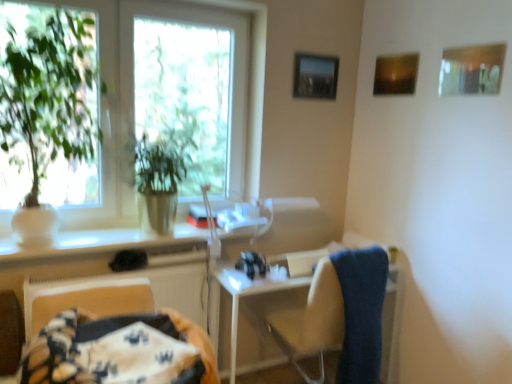
Measure the distance between blue fabric towel at right and camera.

They are 6.12 feet apart.

This screenshot has height=384, width=512. What are the coordinates of `blue fabric towel at right` in the screenshot? It's located at point(361,312).

What is the approximate height of metallic silver picture frame at upper center, the 3th picture frame positioned from the right?

25.22 centimeters.

What do you see at coordinates (315, 76) in the screenshot?
I see `metallic silver picture frame at upper center, the 3th picture frame positioned from the right` at bounding box center [315, 76].

What do you see at coordinates (471, 70) in the screenshot?
I see `wooden frame at upper right, the 1th picture frame when ordered from front to back` at bounding box center [471, 70].

Describe the element at coordinates (396, 74) in the screenshot. Image resolution: width=512 pixels, height=384 pixels. I see `matte wooden picture frame at upper right, which is counted as the 2th picture frame, starting from the back` at that location.

Locate an element on the screen. This screenshot has height=384, width=512. fluffy fabric blanket at lower left is located at coordinates (118, 348).

Can you tell me how much wooden frame at upper right, the 1th picture frame when ordered from front to back, and white glossy counter top at center differ in facing direction?

88.9 degrees.

Locate an element on the screen. Image resolution: width=512 pixels, height=384 pixels. counter top on the left of wooden frame at upper right, the third picture frame when ordered from back to front is located at coordinates (105, 243).

Does wooden frame at upper right, the third picture frame when ordered from back to front, appear on the left side of white glossy counter top at center?

No, wooden frame at upper right, the third picture frame when ordered from back to front, is not to the left of white glossy counter top at center.

Considering the points (460, 67) and (199, 244), which point is in front, point (460, 67) or point (199, 244)?

Positioned in front is point (460, 67).

Considering the positions of objects green leafy plant at left and fluffy fabric blanket at lower left in the image provided, who is more to the left, green leafy plant at left or fluffy fabric blanket at lower left?

From the viewer's perspective, green leafy plant at left appears more on the left side.

Which is in front, point (103, 153) or point (89, 362)?

The point (89, 362) is closer.

Is fluffy fabric blanket at lower left inside green leafy plant at left?

Actually, fluffy fabric blanket at lower left is outside green leafy plant at left.

Are green leafy plant at left and fluffy fabric blanket at lower left far apart?

That's right, there is a large distance between green leafy plant at left and fluffy fabric blanket at lower left.

Is metallic silver picture frame at upper center, which is counted as the 1th picture frame, starting from the left, smaller than matte wooden picture frame at upper right, positioned as the 2th picture frame in left-to-right order?

Incorrect, metallic silver picture frame at upper center, which is counted as the 1th picture frame, starting from the left, is not smaller in size than matte wooden picture frame at upper right, positioned as the 2th picture frame in left-to-right order.

The height and width of the screenshot is (384, 512). I want to click on the 1st picture frame in front of the metallic silver picture frame at upper center, which appears as the first picture frame when viewed from the back, counting from the anchor's position, so click(x=396, y=74).

From a real-world perspective, is metallic silver picture frame at upper center, which is counted as the 1th picture frame, starting from the left, above or below matte wooden picture frame at upper right, which is counted as the 2th picture frame, starting from the back?

From a real-world perspective, metallic silver picture frame at upper center, which is counted as the 1th picture frame, starting from the left, is physically below matte wooden picture frame at upper right, which is counted as the 2th picture frame, starting from the back.

Considering the relative sizes of matte wooden picture frame at upper right, positioned as the 2th picture frame in left-to-right order, and green leafy plant at left in the image provided, is matte wooden picture frame at upper right, positioned as the 2th picture frame in left-to-right order, thinner than green leafy plant at left?

Yes.

Does matte wooden picture frame at upper right, which is counted as the 2th picture frame, starting from the back, appear on the left side of green leafy plant at left?

No, matte wooden picture frame at upper right, which is counted as the 2th picture frame, starting from the back, is not to the left of green leafy plant at left.

Is matte wooden picture frame at upper right, positioned as the 2th picture frame in left-to-right order, turned away from green leafy plant at left?

No, matte wooden picture frame at upper right, positioned as the 2th picture frame in left-to-right order, is not facing away from green leafy plant at left.

From a real-world perspective, relative to green leafy plant at left, is matte wooden picture frame at upper right, which is counted as the 2th picture frame, starting from the front, vertically above or below?

Clearly, from a real-world perspective, matte wooden picture frame at upper right, which is counted as the 2th picture frame, starting from the front, is above green leafy plant at left.

Is green matte plant at left located within metallic silver picture frame at upper center, which appears as the first picture frame when viewed from the back?

Definitely not — green matte plant at left is not inside metallic silver picture frame at upper center, which appears as the first picture frame when viewed from the back.

Based on the photo, which of these two, metallic silver picture frame at upper center, which is counted as the 1th picture frame, starting from the left, or green matte plant at left, stands shorter?

metallic silver picture frame at upper center, which is counted as the 1th picture frame, starting from the left.

Considering the sizes of objects metallic silver picture frame at upper center, the 3th picture frame positioned from the right, and green matte plant at left in the image provided, who is bigger, metallic silver picture frame at upper center, the 3th picture frame positioned from the right, or green matte plant at left?

green matte plant at left.

From the image's perspective, is metallic silver picture frame at upper center, which appears as the first picture frame when viewed from the back, located above or below green matte plant at left?

Clearly, from the image's perspective, metallic silver picture frame at upper center, which appears as the first picture frame when viewed from the back, is above green matte plant at left.

From the image's perspective, between metallic silver picture frame at upper center, which appears as the first picture frame when viewed from the back, and white plastic table at lower center, who is located below?

white plastic table at lower center, from the image's perspective.

Considering the positions of objects metallic silver picture frame at upper center, which is the 3th picture frame in front-to-back order, and white plastic table at lower center in the image provided, who is in front, metallic silver picture frame at upper center, which is the 3th picture frame in front-to-back order, or white plastic table at lower center?

white plastic table at lower center is more forward.

Would you say green matte plant at left is a long distance from white plastic table at lower center?

Yes.

From the picture: Is green matte plant at left looking in the opposite direction of white plastic table at lower center?

No, white plastic table at lower center is not at the back of green matte plant at left.

How different are the orientations of green matte plant at left and white plastic table at lower center in degrees?

0.229 degrees.

Can you confirm if green matte plant at left is taller than white plastic table at lower center?

Correct, green matte plant at left is much taller as white plastic table at lower center.

Where is `counter top below the wooden frame at upper right, the 1th picture frame when ordered from right to left (from the image's perspective)`? This screenshot has height=384, width=512. counter top below the wooden frame at upper right, the 1th picture frame when ordered from right to left (from the image's perspective) is located at coordinates (105, 243).

Where is `window above the fluffy fabric blanket at lower left (from a real-world perspective)`? This screenshot has height=384, width=512. window above the fluffy fabric blanket at lower left (from a real-world perspective) is located at coordinates (133, 95).

Looking at the image, which one is located further to white glossy counter top at center, metallic silver picture frame at upper center, which is counted as the 1th picture frame, starting from the left, or fluffy fabric blanket at lower left?

Based on the image, metallic silver picture frame at upper center, which is counted as the 1th picture frame, starting from the left, appears to be further to white glossy counter top at center.

Estimate the real-world distances between objects in this image. Which object is further from white glossy counter top at center, green matte plant at left or metallic silver picture frame at upper center, which is the 3th picture frame in front-to-back order?

Among the two, metallic silver picture frame at upper center, which is the 3th picture frame in front-to-back order, is located further to white glossy counter top at center.

Based on their spatial positions, is white plastic table at lower center or white glossy counter top at center further from wooden frame at upper right, the 3th picture frame from the left?

Based on the image, white glossy counter top at center appears to be further to wooden frame at upper right, the 3th picture frame from the left.

Which object lies nearer to the anchor point wooden frame at upper right, the third picture frame when ordered from back to front, blue fabric towel at right or white plastic table at lower center?

Among the two, blue fabric towel at right is located nearer to wooden frame at upper right, the third picture frame when ordered from back to front.

Which object lies nearer to the anchor point blue fabric towel at right, matte wooden picture frame at upper right, which is counted as the 2th picture frame, starting from the back, or green leafy plant at left?

The object closer to blue fabric towel at right is green leafy plant at left.

Looking at the image, which one is located further to blue fabric towel at right, metallic silver picture frame at upper center, which is the 3th picture frame in front-to-back order, or fluffy fabric blanket at lower left?

metallic silver picture frame at upper center, which is the 3th picture frame in front-to-back order, is positioned further to the anchor blue fabric towel at right.

Which object lies nearer to the anchor point fluffy fabric blanket at lower left, white plastic table at lower center or green leafy plant at left?

The object closer to fluffy fabric blanket at lower left is white plastic table at lower center.

Which object lies nearer to the anchor point metallic silver picture frame at upper center, which is counted as the 1th picture frame, starting from the left, green matte plant at left or white plastic table at lower center?

Based on the image, white plastic table at lower center appears to be nearer to metallic silver picture frame at upper center, which is counted as the 1th picture frame, starting from the left.

What are the coordinates of `counter top between fluffy fabric blanket at lower left and white plastic table at lower center in the front-back direction` in the screenshot? It's located at (105, 243).

The width and height of the screenshot is (512, 384). What are the coordinates of `bath towel situated between white glossy counter top at center and wooden frame at upper right, the third picture frame when ordered from back to front, from left to right` in the screenshot? It's located at (361, 312).

Find the location of a particular element. This screenshot has height=384, width=512. counter top situated between green leafy plant at left and metallic silver picture frame at upper center, the 3th picture frame positioned from the right, from left to right is located at coordinates (105, 243).

The height and width of the screenshot is (384, 512). What are the coordinates of `houseplant between fluffy fabric blanket at lower left and metallic silver picture frame at upper center, the 3th picture frame positioned from the right, from front to back` in the screenshot? It's located at click(x=47, y=107).